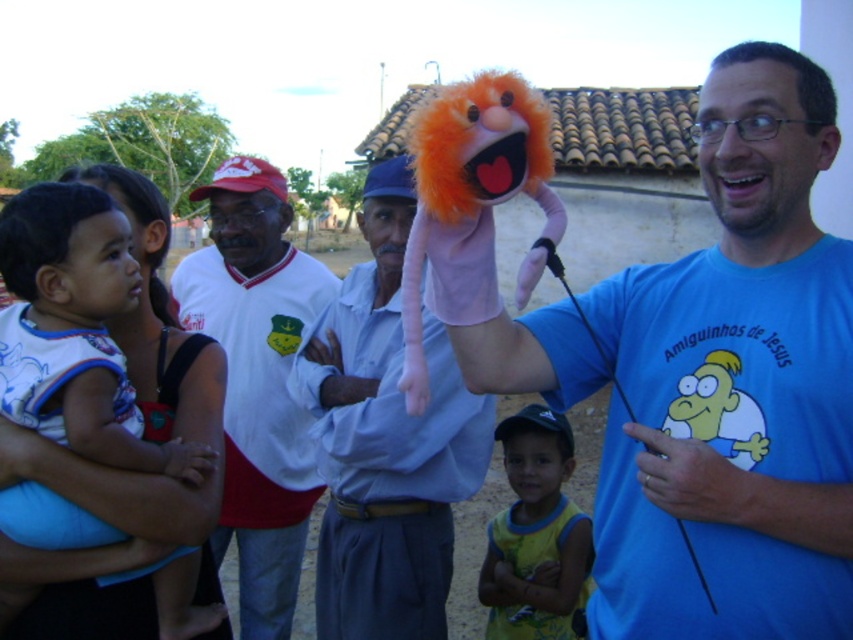
Question: Which of the following is the farthest from the observer?

Choices:
 (A) orange furry puppet at upper center
 (B) soft blue fabric baby at left
 (C) white jersey at center
 (D) yellow fabric shirt at center

Answer: (C)

Question: Is soft blue fabric baby at left bigger than yellow fabric shirt at center?

Choices:
 (A) no
 (B) yes

Answer: (B)

Question: Which point is farther to the camera?

Choices:
 (A) light blue cotton shirt at center
 (B) fluffy orange puppet at center
 (C) soft blue fabric baby at left
 (D) yellow fabric shirt at center

Answer: (D)

Question: Is orange furry puppet at upper center wider than yellow fabric shirt at center?

Choices:
 (A) yes
 (B) no

Answer: (A)

Question: Which point appears closest to the camera in this image?

Choices:
 (A) click(x=300, y=401)
 (B) click(x=851, y=561)

Answer: (B)

Question: Is orange furry puppet at upper center further to the viewer compared to light blue cotton shirt at center?

Choices:
 (A) yes
 (B) no

Answer: (B)